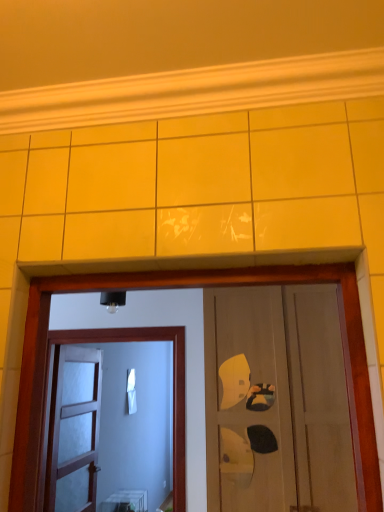
Question: Is matte wooden door at center, arranged as the 2th door when viewed from the right, a part of matte wooden door at center, the third door viewed from the left?

Choices:
 (A) no
 (B) yes

Answer: (A)

Question: Considering the relative sizes of matte wooden door at center, the third door viewed from the left, and matte wooden door at center, marked as the second door in a left-to-right arrangement, in the image provided, is matte wooden door at center, the third door viewed from the left, thinner than matte wooden door at center, marked as the second door in a left-to-right arrangement,?

Choices:
 (A) yes
 (B) no

Answer: (B)

Question: Is the position of matte wooden door at center, which appears as the 1th door when viewed from the right, less distant than that of matte wooden door at center, arranged as the 2th door when viewed from the right?

Choices:
 (A) no
 (B) yes

Answer: (B)

Question: Is matte wooden door at center, the third door viewed from the left, further to camera compared to matte wooden door at center, marked as the second door in a left-to-right arrangement?

Choices:
 (A) yes
 (B) no

Answer: (B)

Question: Considering the relative sizes of matte wooden door at center, which appears as the 1th door when viewed from the right, and matte wooden door at center, arranged as the 2th door when viewed from the right, in the image provided, is matte wooden door at center, which appears as the 1th door when viewed from the right, shorter than matte wooden door at center, arranged as the 2th door when viewed from the right,?

Choices:
 (A) yes
 (B) no

Answer: (B)

Question: Is translucent glass door at center, the first door from the left, to the left or to the right of matte wooden door at center, the third door viewed from the left, in the image?

Choices:
 (A) left
 (B) right

Answer: (A)

Question: From the image's perspective, is translucent glass door at center, the first door from the left, located above or below matte wooden door at center, the third door viewed from the left?

Choices:
 (A) below
 (B) above

Answer: (A)

Question: Is translucent glass door at center, which appears as the third door when viewed from the right, inside or outside of matte wooden door at center, the third door viewed from the left?

Choices:
 (A) inside
 (B) outside

Answer: (B)

Question: Is translucent glass door at center, the first door from the left, wider or thinner than matte wooden door at center, which appears as the 1th door when viewed from the right?

Choices:
 (A) thin
 (B) wide

Answer: (A)

Question: Do you think translucent glass door at center, the first door from the left, is within matte wooden door at center, arranged as the 2th door when viewed from the right, or outside of it?

Choices:
 (A) inside
 (B) outside

Answer: (B)

Question: Based on their positions, is translucent glass door at center, which appears as the third door when viewed from the right, located to the left or right of matte wooden door at center, marked as the second door in a left-to-right arrangement?

Choices:
 (A) left
 (B) right

Answer: (A)

Question: Looking at the image, does translucent glass door at center, which appears as the third door when viewed from the right, seem bigger or smaller compared to matte wooden door at center, arranged as the 2th door when viewed from the right?

Choices:
 (A) big
 (B) small

Answer: (A)

Question: In the image, is translucent glass door at center, which appears as the third door when viewed from the right, positioned in front of or behind matte wooden door at center, marked as the second door in a left-to-right arrangement?

Choices:
 (A) front
 (B) behind

Answer: (B)

Question: In terms of height, does matte wooden door at center, which appears as the 1th door when viewed from the right, look taller or shorter compared to translucent glass door at center, which appears as the third door when viewed from the right?

Choices:
 (A) short
 (B) tall

Answer: (B)

Question: Is point (206, 334) positioned closer to the camera than point (94, 498)?

Choices:
 (A) closer
 (B) farther

Answer: (A)